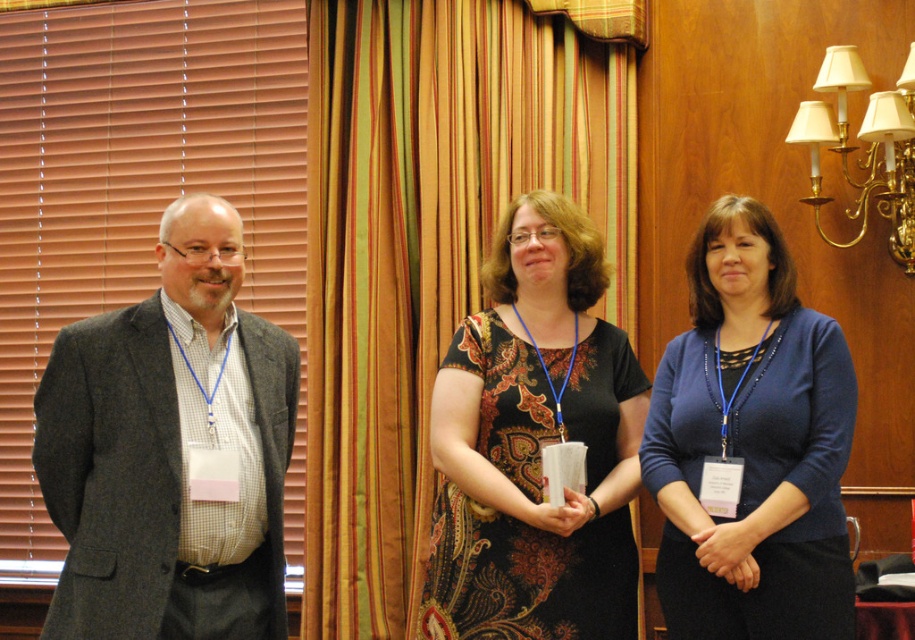
You are a photographer setting up for a group photo. You notice the striped fabric curtain at center and the blue fabric sweater at center in the background. Which one is wider?

The striped fabric curtain at center is wider than the blue fabric sweater at center.

You are attending a formal event and need to find the gray wool suit at left and the blue fabric sweater at center. Based on their positions, which one is closer to the window with closed blinds on the left side?

The gray wool suit at left is closer to the window with closed blinds on the left side because it is positioned to the left of the blue fabric sweater at center, which is further away from the window.